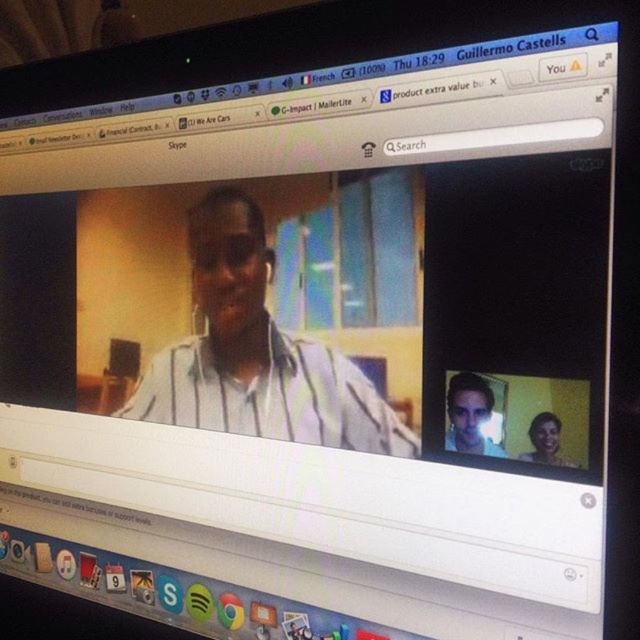
Between matte white shirt at upper right and matte white shirt at lower right, which one is positioned higher?

Positioned higher is matte white shirt at upper right.

Does point (454, 372) come closer to viewer compared to point (556, 426)?

No, it is not.

Is point (461, 410) positioned after point (538, 452)?

Yes, it is.

The width and height of the screenshot is (640, 640). I want to click on matte white shirt at upper right, so click(470, 413).

Which is more to the right, white striped shirt at center or matte white shirt at upper right?

matte white shirt at upper right

Can you confirm if white striped shirt at center is shorter than matte white shirt at upper right?

No, white striped shirt at center is not shorter than matte white shirt at upper right.

What do you see at coordinates (257, 353) in the screenshot?
I see `white striped shirt at center` at bounding box center [257, 353].

The image size is (640, 640). I want to click on white striped shirt at center, so click(x=257, y=353).

This screenshot has width=640, height=640. What do you see at coordinates (257, 353) in the screenshot?
I see `white striped shirt at center` at bounding box center [257, 353].

Can you confirm if white striped shirt at center is thinner than matte white shirt at lower right?

In fact, white striped shirt at center might be wider than matte white shirt at lower right.

The height and width of the screenshot is (640, 640). What do you see at coordinates (257, 353) in the screenshot?
I see `white striped shirt at center` at bounding box center [257, 353].

Locate an element on the screen. white striped shirt at center is located at coordinates (257, 353).